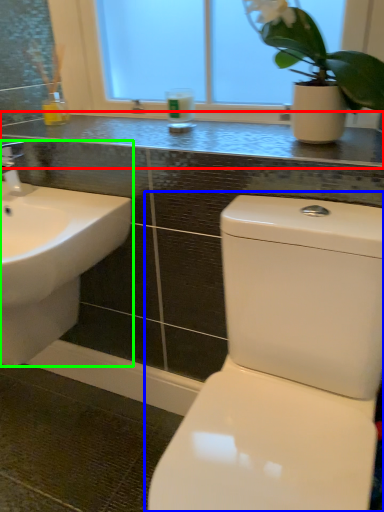
Question: Which is farther away from counter top (highlighted by a red box)? toilet (highlighted by a blue box) or sink (highlighted by a green box)?

Choices:
 (A) toilet
 (B) sink

Answer: (A)